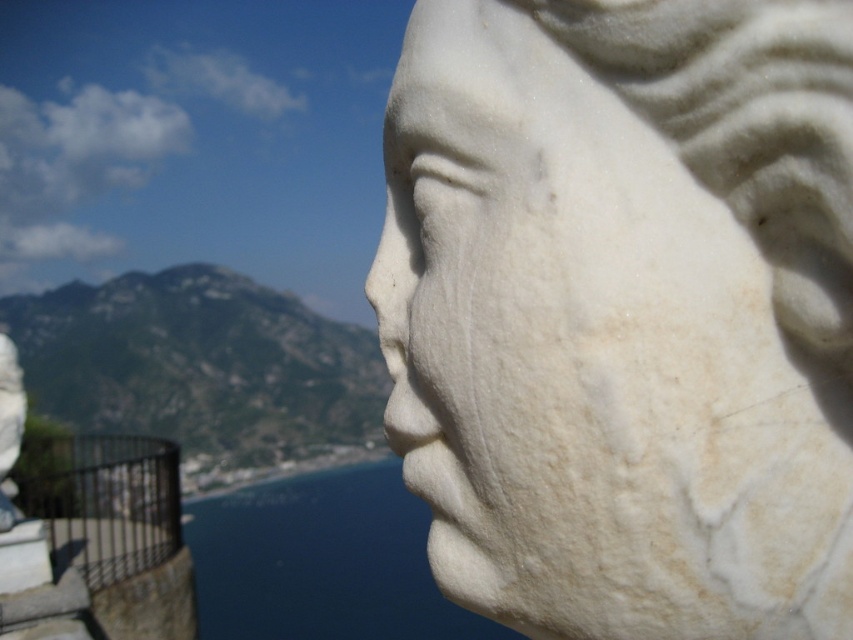
You are an art curator planning to display the white marble bust at right and the black metal rail at lower left in a new exhibition. Given their spatial relationship in the current image, which object should be placed closer to the exhibition entrance to ensure visitors can easily view both items without obstruction?

The white marble bust at right has a lesser width compared to the black metal rail at lower left. To prevent obstruction, the narrower white marble bust at right should be placed closer to the entrance so visitors can see both items easily.

Consider the image. You are an art curator planning to display the white marble bust at right and the blue water at lower center in a new exhibition. Based on their sizes, which object would you place on a higher pedestal to ensure both are visually balanced?

The white marble bust at right has a lesser height compared to blue water at lower center, so to balance their visual presentation, the white marble bust at right should be placed on a higher pedestal.

You are an art student who wants to sketch the white marble bust at right and the black metal rail at lower left. Which object should you focus on first if you want to draw the one that takes up more space in the image?

The black metal rail at lower left takes up more space in the image than the white marble bust at right, so you should focus on drawing the black metal rail at lower left first.